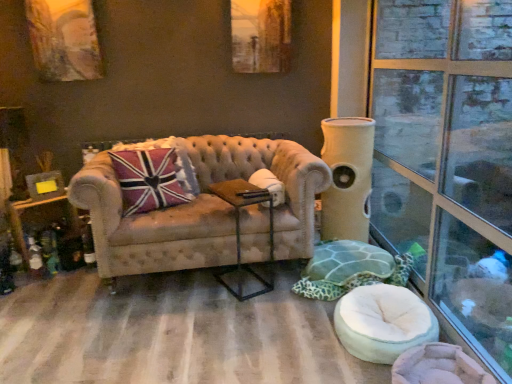
The image size is (512, 384). I want to click on free space that is in between metallic brown side table at center and green fabric swivel chair at lower right, placed as the 2th swivel chair when sorted from front to back, so click(x=274, y=283).